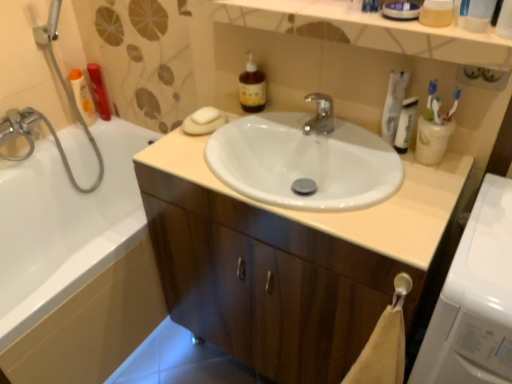
The width and height of the screenshot is (512, 384). I want to click on blank area to the left of white plastic cup at upper right, so click(x=375, y=165).